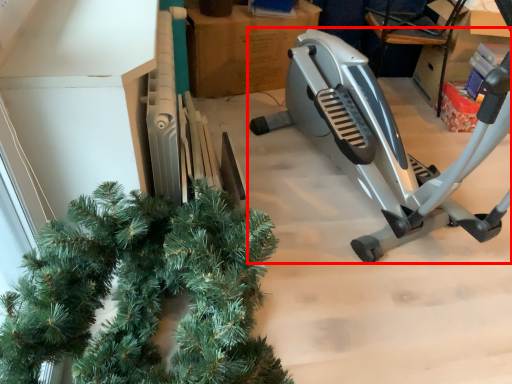
Question: From the image, what is the correct spatial relationship of stationary bicycle (annotated by the red box) in relation to cardboard box?

Choices:
 (A) right
 (B) left

Answer: (A)